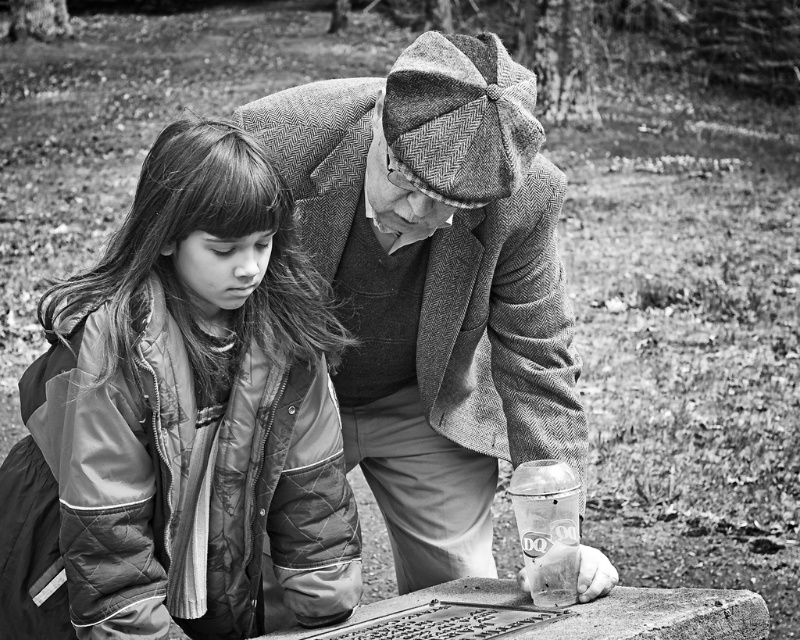
Is quilted nylon jacket at center bigger than woolen coat at center?

Incorrect, quilted nylon jacket at center is not larger than woolen coat at center.

How far apart are quilted nylon jacket at center and woolen coat at center?

The distance of quilted nylon jacket at center from woolen coat at center is 26.65 inches.

What do you see at coordinates (182, 419) in the screenshot? The width and height of the screenshot is (800, 640). I see `quilted nylon jacket at center` at bounding box center [182, 419].

The height and width of the screenshot is (640, 800). Identify the location of quilted nylon jacket at center. (182, 419).